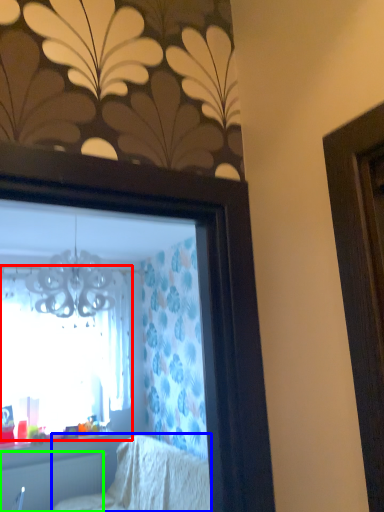
Question: Considering the real-world distances, which object is closest to window (highlighted by a red box)? furniture (highlighted by a blue box) or radiator (highlighted by a green box).

Choices:
 (A) furniture
 (B) radiator

Answer: (B)